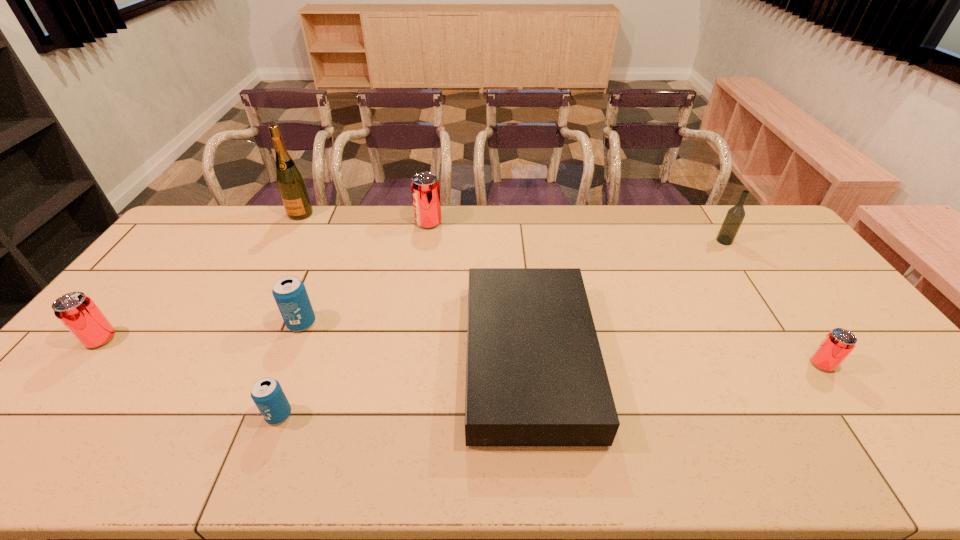
Where is `the fourth farthest soda can`? the fourth farthest soda can is located at coordinates (837, 345).

Find the location of `the nearest soda can`. the nearest soda can is located at coordinates (267, 393).

The width and height of the screenshot is (960, 540). I want to click on the nearer blue soda can, so click(x=267, y=393).

What are the coordinates of `the sixth object from left to right` in the screenshot? It's located at (535, 376).

Where is `the shortest object`? Image resolution: width=960 pixels, height=540 pixels. the shortest object is located at coordinates (535, 376).

Identify the location of vacant area located on the front-facing side of the second object from left to right. The width and height of the screenshot is (960, 540). (260, 289).

I want to click on vacant space situated on the front of the sixth nearest object, so pos(734,256).

In order to click on free spot located on the left of the farthest red soda can in this screenshot , I will do `click(370, 222)`.

Identify the location of vacant position located on the right of the leftmost red soda can. The image size is (960, 540). (173, 339).

This screenshot has width=960, height=540. I want to click on vacant area situated on the back of the bigger blue soda can, so click(337, 235).